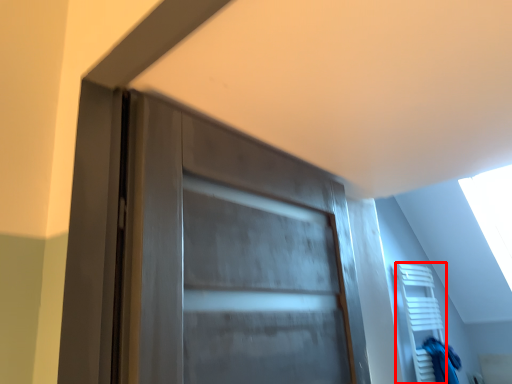
Question: From the image, what is the correct spatial relationship of shelf (annotated by the red box) in relation to scrub?

Choices:
 (A) right
 (B) left

Answer: (B)